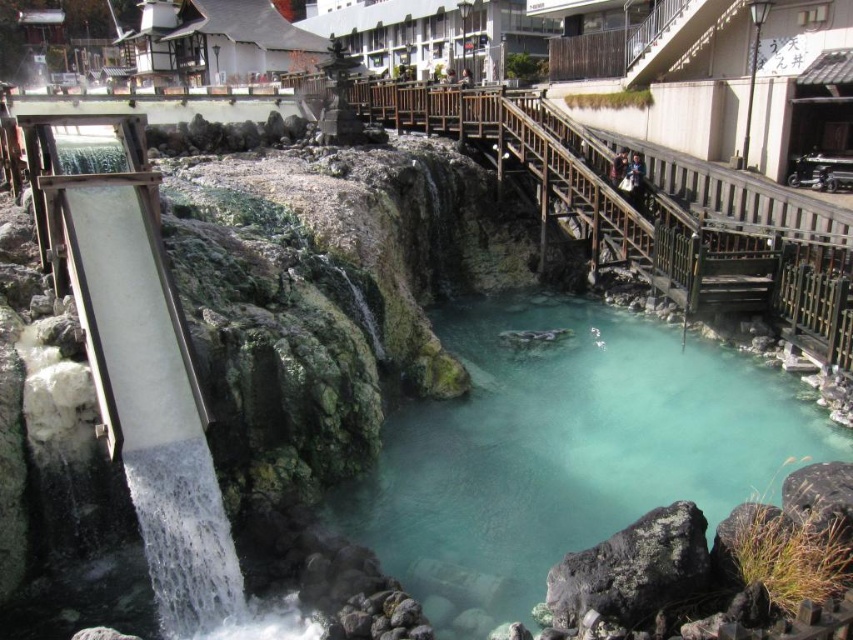
Question: Which point appears closest to the camera in this image?

Choices:
 (A) (131, 275)
 (B) (593, 440)

Answer: (A)

Question: From the image, what is the correct spatial relationship of turquoise stone water at center in relation to white concrete waterfall at left?

Choices:
 (A) left
 (B) right

Answer: (B)

Question: Can you confirm if turquoise stone water at center is wider than white concrete waterfall at left?

Choices:
 (A) no
 (B) yes

Answer: (B)

Question: Does turquoise stone water at center have a lesser width compared to white concrete waterfall at left?

Choices:
 (A) yes
 (B) no

Answer: (B)